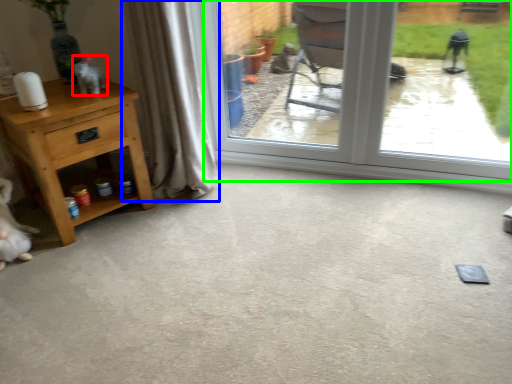
Question: Based on their relative distances, which object is farther from animal (highlighted by a red box)? Choose from curtain (highlighted by a blue box) and window (highlighted by a green box).

Choices:
 (A) curtain
 (B) window

Answer: (B)